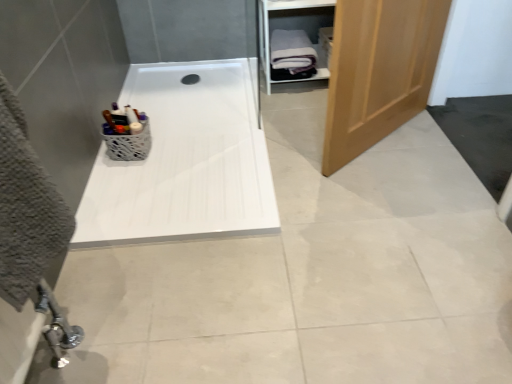
Question: Visually, is wooden door at right positioned to the left or to the right of white soft towel at upper right?

Choices:
 (A) left
 (B) right

Answer: (B)

Question: Would you say wooden door at right is inside or outside white soft towel at upper right?

Choices:
 (A) outside
 (B) inside

Answer: (A)

Question: Based on their relative distances, which object is farther from the white soft towel at upper right?

Choices:
 (A) white glossy bath at center
 (B) wooden door at right
 (C) white textured basket at upper left
 (D) white wood cabinet at upper right

Answer: (C)

Question: Estimate the real-world distances between objects in this image. Which object is farther from the wooden door at right?

Choices:
 (A) white wood cabinet at upper right
 (B) white glossy bath at center
 (C) white soft towel at upper right
 (D) white textured basket at upper left

Answer: (D)